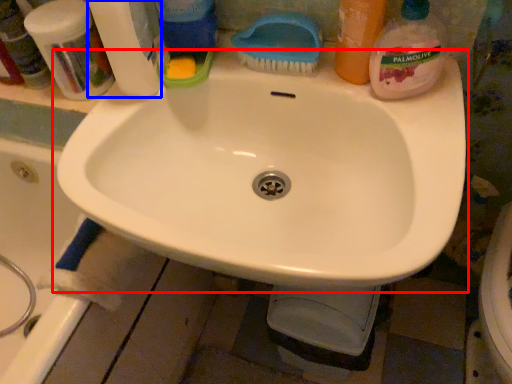
Question: Among these objects, which one is farthest to the camera, sink (highlighted by a red box) or cleaning product (highlighted by a blue box)?

Choices:
 (A) sink
 (B) cleaning product

Answer: (B)